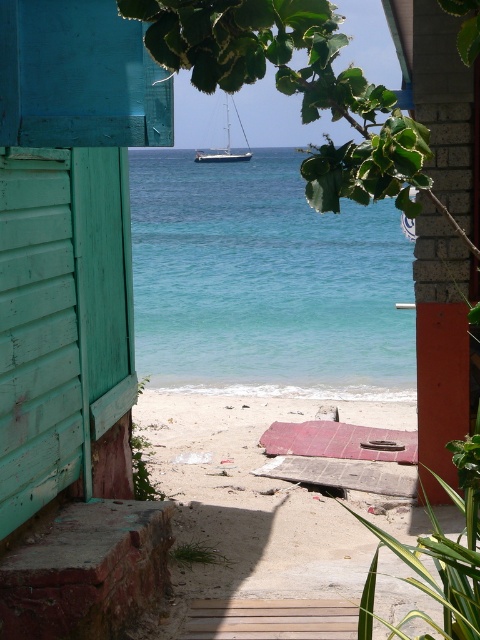
You are standing at the point marked by the coordinates point (72, 321) in the scene. What object are you standing on?

The point (72, 321) indicates the teal wooden beach hut at left, so you are standing on the teal wooden beach hut at left.